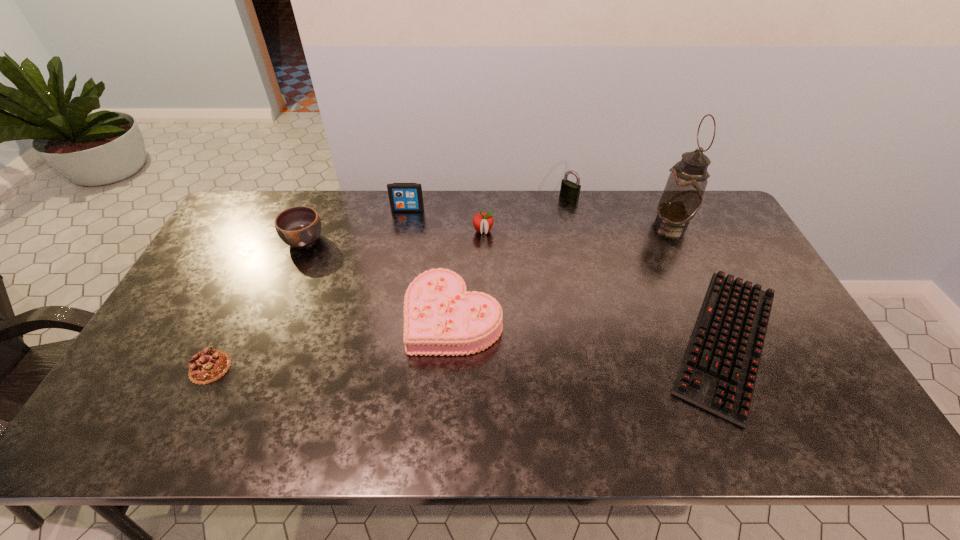
This screenshot has width=960, height=540. Find the location of `the seventh closest object to the farthest object`. the seventh closest object to the farthest object is located at coordinates (207, 366).

Where is `object that can be found as the second closest to the tallest object`? object that can be found as the second closest to the tallest object is located at coordinates (569, 190).

Where is `vacant space that satisfies the following two spatial constraints: 1. on the back side of the bowl; 2. on the left side of the padlock`? The width and height of the screenshot is (960, 540). vacant space that satisfies the following two spatial constraints: 1. on the back side of the bowl; 2. on the left side of the padlock is located at coordinates (323, 198).

In order to click on vacant space that satisfies the following two spatial constraints: 1. on the front screen of the apple; 2. on the left side of the iPod in this screenshot , I will do `click(404, 231)`.

Find the location of `free space that satisfies the following two spatial constraints: 1. on the front screen of the iPod; 2. on the right side of the apple`. free space that satisfies the following two spatial constraints: 1. on the front screen of the iPod; 2. on the right side of the apple is located at coordinates (404, 231).

The image size is (960, 540). Identify the location of blank area in the image that satisfies the following two spatial constraints: 1. on the front side of the cake; 2. on the right side of the shortest object. (452, 341).